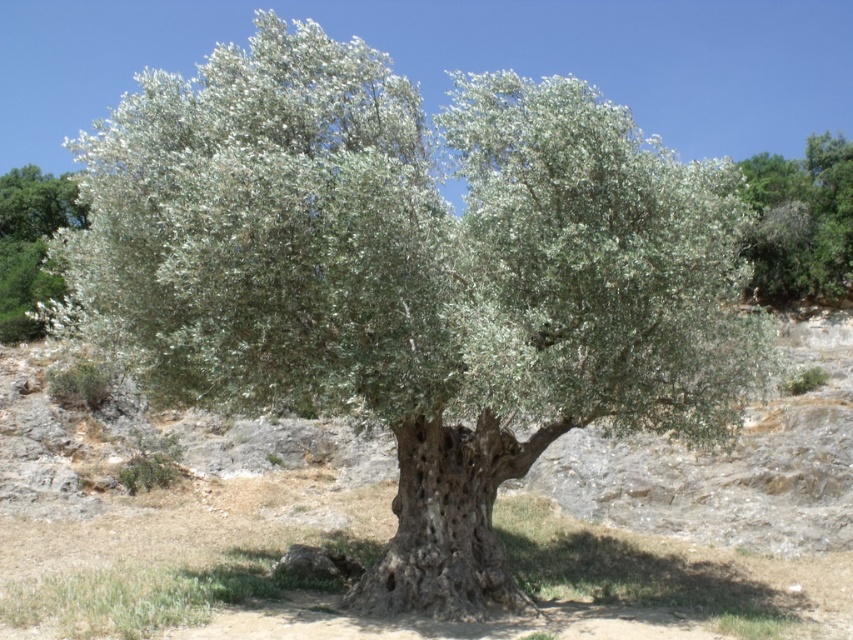
Is green leafy tree at upper right positioned in front of green leafy tree at upper left?

No, green leafy tree at upper right is further to the viewer.

Does green leafy tree at upper right lie behind green leafy tree at upper left?

Yes.

You are a GUI agent. You are given a task and a screenshot of the screen. Output one action in this format:
    pyautogui.click(x=<x>, y=<y>)
    Task: Click on the green leafy tree at upper right
    
    Given the screenshot: What is the action you would take?
    pyautogui.click(x=801, y=221)